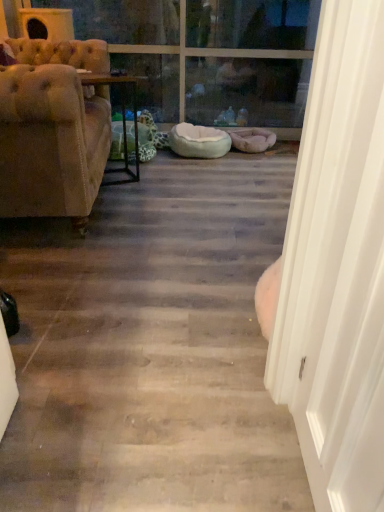
This screenshot has height=512, width=384. Describe the element at coordinates (50, 143) in the screenshot. I see `tufted beige fabric couch at left` at that location.

What is the approximate height of transparent glass door at upper center?

38.89 inches.

The image size is (384, 512). I want to click on transparent glass door at upper center, so click(x=249, y=61).

In order to face wooden table at center, should I rotate leftwards or rightwards?

To align with it, rotate left about 11.166°.

The height and width of the screenshot is (512, 384). In order to click on light blue plush dog bed at center in this screenshot , I will do `click(199, 141)`.

Does tufted beige fabric couch at left have a lesser width compared to light blue plush dog bed at center?

In fact, tufted beige fabric couch at left might be wider than light blue plush dog bed at center.

From a real-world perspective, which object rests below the other?

In real-world perspective, light blue plush dog bed at center is lower.

Who is smaller, tufted beige fabric couch at left or light blue plush dog bed at center?

Smaller between the two is light blue plush dog bed at center.

How different are the orientations of tufted beige fabric couch at left and light blue plush dog bed at center in degrees?

The angular difference between tufted beige fabric couch at left and light blue plush dog bed at center is 96.2 degrees.

From the image's perspective, who appears lower, clear glass window at upper center or tufted beige fabric couch at left?

tufted beige fabric couch at left, from the image's perspective.

Can you confirm if clear glass window at upper center is bigger than tufted beige fabric couch at left?

No, clear glass window at upper center is not bigger than tufted beige fabric couch at left.

Does point (290, 91) come farther from viewer compared to point (88, 170)?

Yes, point (290, 91) is farther from viewer.

Which object is closer to the camera, clear glass window at upper center or tufted beige fabric couch at left?

tufted beige fabric couch at left is in front.

Consider the image. Considering the relative sizes of white smooth door at right and clear glass window at upper center in the image provided, is white smooth door at right taller than clear glass window at upper center?

Yes.

Which of these two, white smooth door at right or clear glass window at upper center, is bigger?

Bigger between the two is clear glass window at upper center.

Is white smooth door at right wider or thinner than clear glass window at upper center?

white smooth door at right is thinner than clear glass window at upper center.

Is white smooth door at right positioned before clear glass window at upper center?

Yes, it is in front of clear glass window at upper center.

Would you say tufted beige fabric couch at left is to the left or to the right of white smooth door at right in the picture?

Clearly, tufted beige fabric couch at left is on the left of white smooth door at right in the image.

Looking at this image, considering their positions, is tufted beige fabric couch at left located in front of or behind white smooth door at right?

tufted beige fabric couch at left is positioned farther from the viewer than white smooth door at right.

Consider the image. From the image's perspective, is tufted beige fabric couch at left located above or below white smooth door at right?

Based on their image positions, tufted beige fabric couch at left is located above white smooth door at right.

Is tufted beige fabric couch at left turned away from white smooth door at right?

No.

Between point (107, 83) and point (277, 45), which one is positioned in front?

The point (107, 83) is more forward.

How many degrees apart are the facing directions of wooden table at center and transparent glass door at upper center?

63.5 degrees separate the facing orientations of wooden table at center and transparent glass door at upper center.

Is wooden table at center thinner than transparent glass door at upper center?

Correct, the width of wooden table at center is less than that of transparent glass door at upper center.

Based on the photo, can you confirm if wooden table at center is positioned to the right of transparent glass door at upper center?

No.

This screenshot has height=512, width=384. I want to click on screen door in front of the tufted beige fabric couch at left, so click(x=337, y=267).

Between white smooth door at right and tufted beige fabric couch at left, which one has more height?

With more height is white smooth door at right.

Considering the positions of point (295, 263) and point (49, 81), is point (295, 263) closer or farther from the camera than point (49, 81)?

Point (295, 263) is positioned closer to the camera compared to point (49, 81).

Is white smooth door at right next to tufted beige fabric couch at left and touching it?

No.

Is transparent glass door at upper center far away from clear glass window at upper center?

They are positioned close to each other.

Can you confirm if transparent glass door at upper center is wider than clear glass window at upper center?

No.

From the image's perspective, which one is positioned lower, transparent glass door at upper center or clear glass window at upper center?

From the image's view, transparent glass door at upper center is below.

Is point (292, 78) positioned after point (314, 7)?

Yes, point (292, 78) is behind point (314, 7).

I want to click on chair above the light blue plush dog bed at center (from a real-world perspective), so click(x=50, y=143).

Where is `chair below the clear glass window at upper center (from the image's perspective)`? chair below the clear glass window at upper center (from the image's perspective) is located at coordinates (x=50, y=143).

Which object lies further to the anchor point tufted beige fabric couch at left, clear glass window at upper center or wooden table at center?

clear glass window at upper center is further to tufted beige fabric couch at left.

Looking at the image, which one is located further to transparent glass door at upper center, wooden table at center or clear glass window at upper center?

wooden table at center is further to transparent glass door at upper center.

Based on their spatial positions, is wooden table at center or light blue plush dog bed at center closer to transparent glass door at upper center?

The object closer to transparent glass door at upper center is light blue plush dog bed at center.

Based on their spatial positions, is white smooth door at right or wooden table at center closer to clear glass window at upper center?

wooden table at center is closer to clear glass window at upper center.

Which object lies further to the anchor point light blue plush dog bed at center, clear glass window at upper center or white smooth door at right?

white smooth door at right lies further to light blue plush dog bed at center than the other object.

Which object lies nearer to the anchor point clear glass window at upper center, tufted beige fabric couch at left or transparent glass door at upper center?

Based on the image, transparent glass door at upper center appears to be nearer to clear glass window at upper center.

From the image, which object appears to be farther from white smooth door at right, tufted beige fabric couch at left or transparent glass door at upper center?

Among the two, transparent glass door at upper center is located further to white smooth door at right.

Considering their positions, is wooden table at center positioned closer to transparent glass door at upper center than tufted beige fabric couch at left?

wooden table at center is positioned closer to the anchor transparent glass door at upper center.

Find the location of a particular element. The width and height of the screenshot is (384, 512). glass door between clear glass window at upper center and light blue plush dog bed at center from top to bottom is located at coordinates (249, 61).

The image size is (384, 512). What are the coordinates of `window between tufted beige fabric couch at left and transparent glass door at upper center from front to back` in the screenshot? It's located at (216, 51).

Where is `window between white smooth door at right and transparent glass door at upper center in the front-back direction`? The height and width of the screenshot is (512, 384). window between white smooth door at right and transparent glass door at upper center in the front-back direction is located at coordinates (216, 51).

The width and height of the screenshot is (384, 512). I want to click on window positioned between tufted beige fabric couch at left and light blue plush dog bed at center from near to far, so click(x=216, y=51).